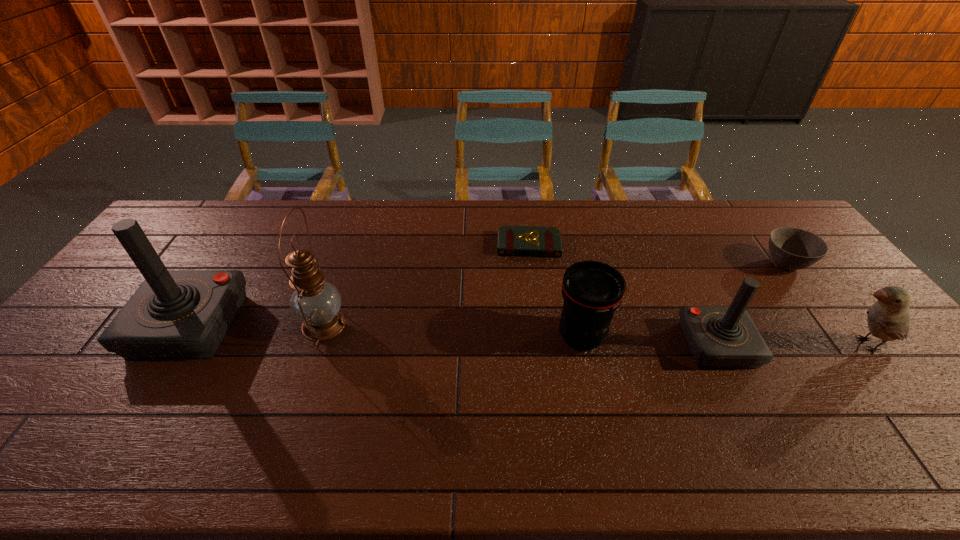
Locate an element on the screen. The image size is (960, 540). empty space between the shortest object and the oil lamp is located at coordinates (426, 285).

Locate an element on the screen. free space between the oil lamp and the second shortest object is located at coordinates (555, 294).

I want to click on blank region between the sixth tallest object and the oil lamp, so click(555, 294).

Find the location of a particular element. This screenshot has height=540, width=960. vacant area that lies between the book and the sixth tallest object is located at coordinates click(x=657, y=254).

In order to click on vacant space that is in between the shortest object and the left joystick in this screenshot , I will do pyautogui.click(x=359, y=285).

In order to click on vacant area between the right joystick and the left joystick in this screenshot , I will do `click(453, 335)`.

Point out which object is positioned as the nearest to the telephoto lens. Please provide its 2D coordinates. Your answer should be formatted as a tuple, i.e. [(x, y)], where the tuple contains the x and y coordinates of a point satisfying the conditions above.

[(718, 336)]

Select which object appears as the fifth closest to the bird. Please provide its 2D coordinates. Your answer should be formatted as a tuple, i.e. [(x, y)], where the tuple contains the x and y coordinates of a point satisfying the conditions above.

[(315, 302)]

What are the coordinates of `vacant space that satisfies the following two spatial constraints: 1. on the back side of the telephoto lens; 2. on the rectangular base of the taller joystick` in the screenshot? It's located at (579, 326).

What are the coordinates of `vacant point that satisfies the following two spatial constraints: 1. on the rectangular base of the taller joystick; 2. on the left side of the telephoto lens` in the screenshot? It's located at (183, 336).